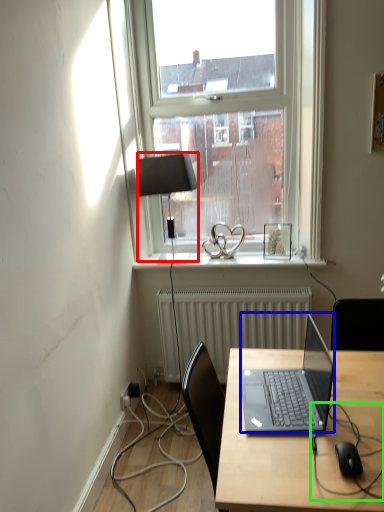
Question: Based on their relative distances, which object is farther from lamp (highlighted by a red box)? Choose from laptop (highlighted by a blue box) and cable (highlighted by a green box).

Choices:
 (A) laptop
 (B) cable

Answer: (B)